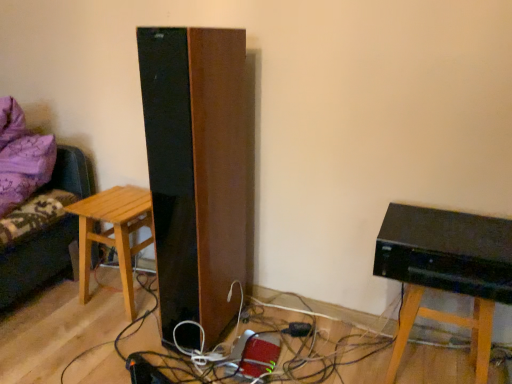
Question: Would you say black plastic plug at lower center is to the left or to the right of light brown wooden stool at left in the picture?

Choices:
 (A) left
 (B) right

Answer: (B)

Question: Is black plastic plug at lower center inside or outside of light brown wooden stool at left?

Choices:
 (A) outside
 (B) inside

Answer: (A)

Question: Considering the real-world distances, which object is farthest from the black plastic plug at lower center?

Choices:
 (A) black glossy computer at lower right
 (B) purple fabric couch at left
 (C) light brown wooden stool at left

Answer: (B)

Question: Estimate the real-world distances between objects in this image. Which object is closer to the light brown wooden stool at left?

Choices:
 (A) purple fabric couch at left
 (B) black plastic plug at lower center
 (C) black glossy computer at lower right

Answer: (A)